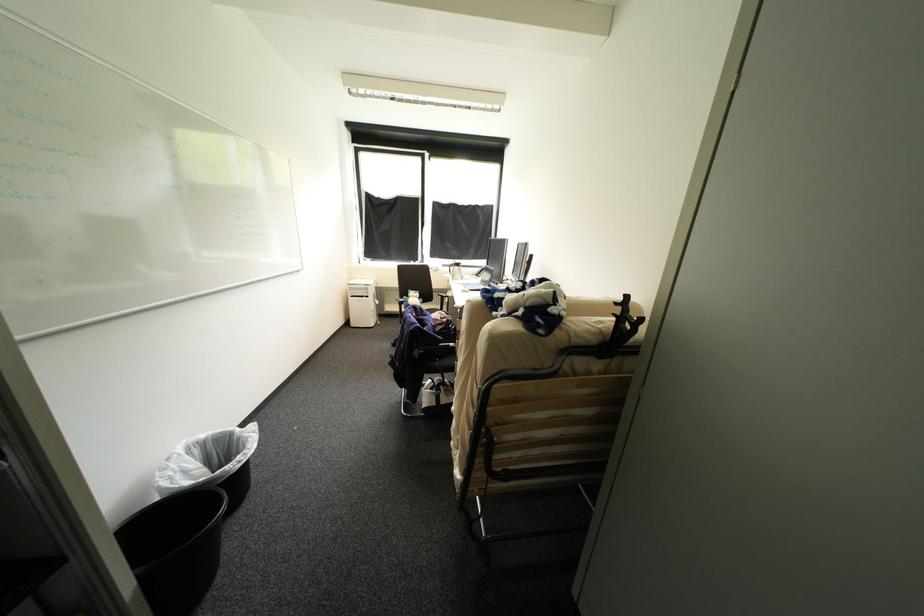
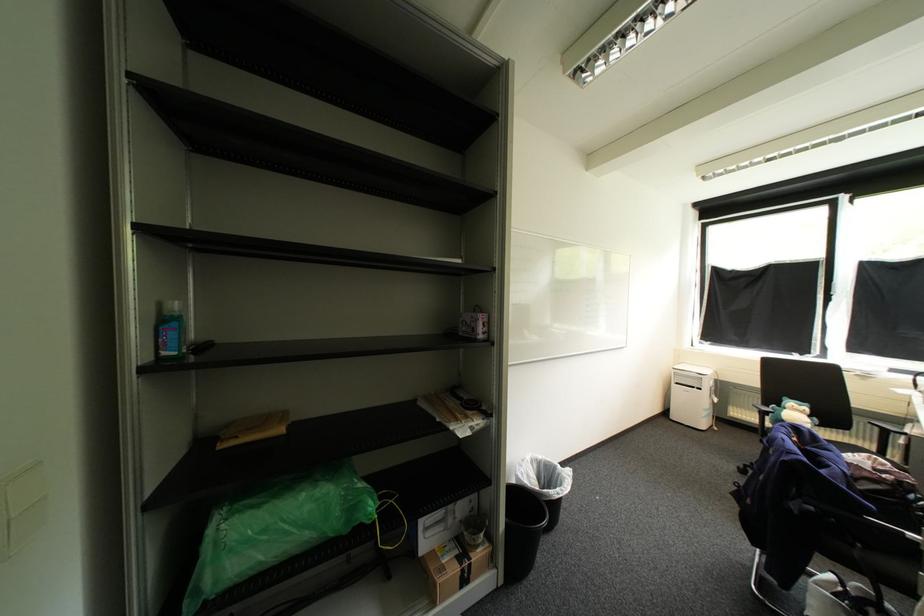
Where in the second image is the point corresponding to point (457, 345) from the first image?

(917, 535)